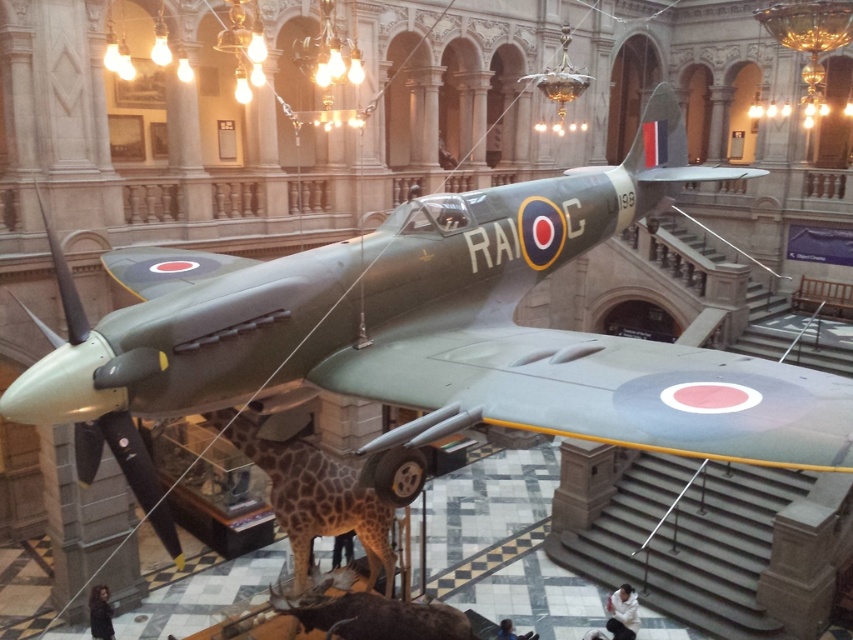
Is point (332, 502) positioned before point (351, 628)?

No, it is behind (351, 628).

Can you confirm if spotted fur giraffe at center is shorter than shiny brown antelope at lower center?

In fact, spotted fur giraffe at center may be taller than shiny brown antelope at lower center.

I want to click on spotted fur giraffe at center, so click(312, 496).